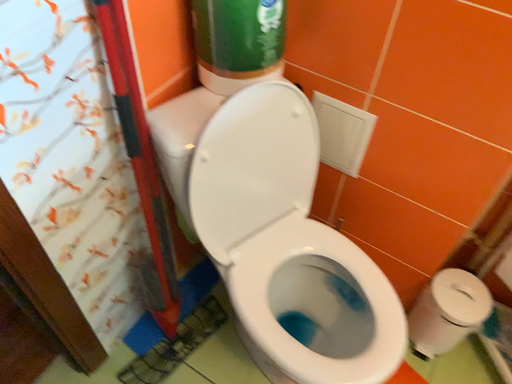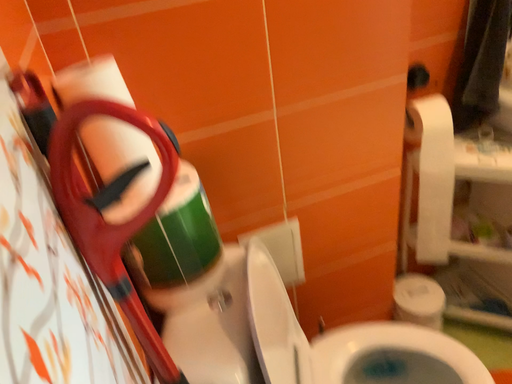
Question: How did the camera likely rotate when shooting the video?

Choices:
 (A) rotated right
 (B) rotated left

Answer: (A)